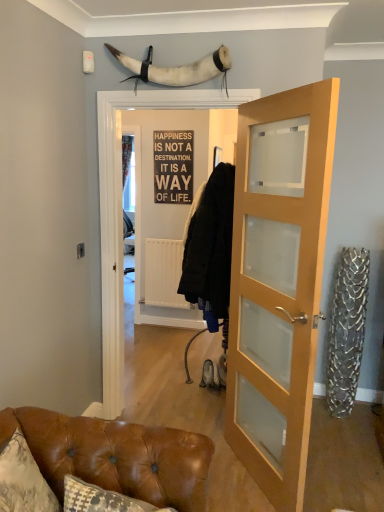
Question: Visually, is brown leather couch at lower left positioned to the left or to the right of light wood/glass door at center?

Choices:
 (A) left
 (B) right

Answer: (A)

Question: Is point (107, 473) positioned closer to the camera than point (231, 264)?

Choices:
 (A) farther
 (B) closer

Answer: (B)

Question: Which object is the farthest from the brown leather couch at lower left?

Choices:
 (A) light wood/glass door at center
 (B) metallic sign at center
 (C) white fur horn at upper center

Answer: (B)

Question: Which object is positioned closest to the white fur horn at upper center?

Choices:
 (A) metallic sign at center
 (B) brown leather couch at lower left
 (C) light wood/glass door at center

Answer: (C)